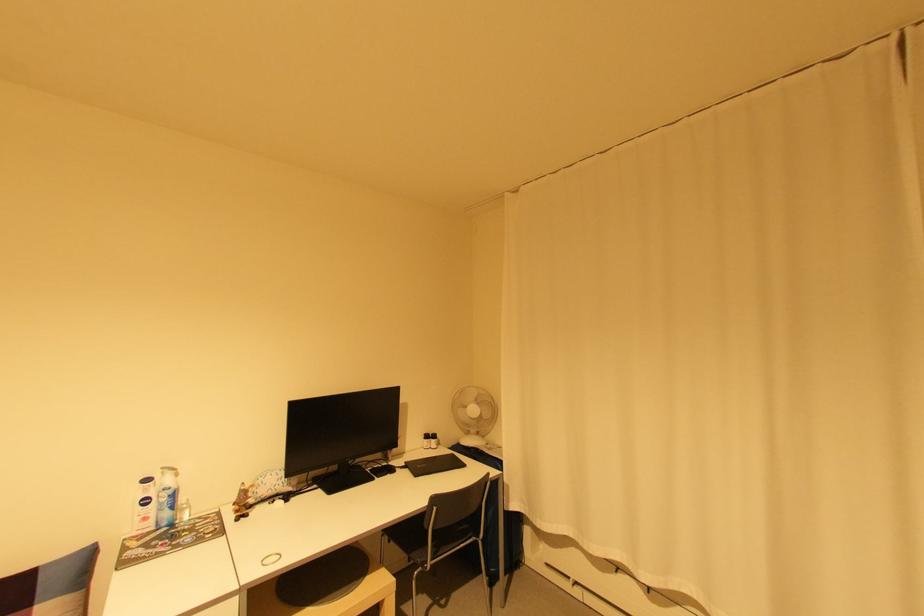
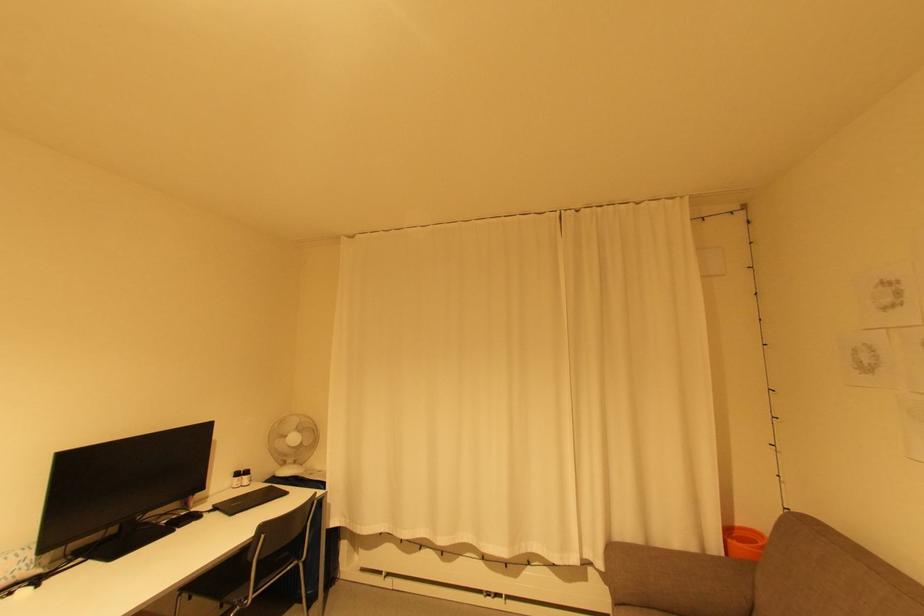
Where in the second image is the point corresponding to point (438, 532) from the first image?

(262, 562)